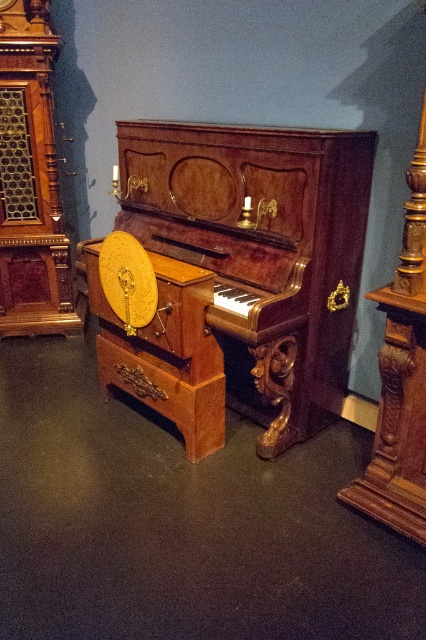
Question: Which point is closer to the camera taking this photo?

Choices:
 (A) (36, 227)
 (B) (166, 154)

Answer: (B)

Question: Is mahogany polished piano at center in front of polished wood clock at left?

Choices:
 (A) yes
 (B) no

Answer: (A)

Question: Is mahogany polished piano at center behind polished wood clock at left?

Choices:
 (A) no
 (B) yes

Answer: (A)

Question: Which point is farther to the camera?

Choices:
 (A) polished wood clock at left
 (B) mahogany polished piano at center

Answer: (A)

Question: Can you confirm if mahogany polished piano at center is positioned to the right of polished wood clock at left?

Choices:
 (A) no
 (B) yes

Answer: (B)